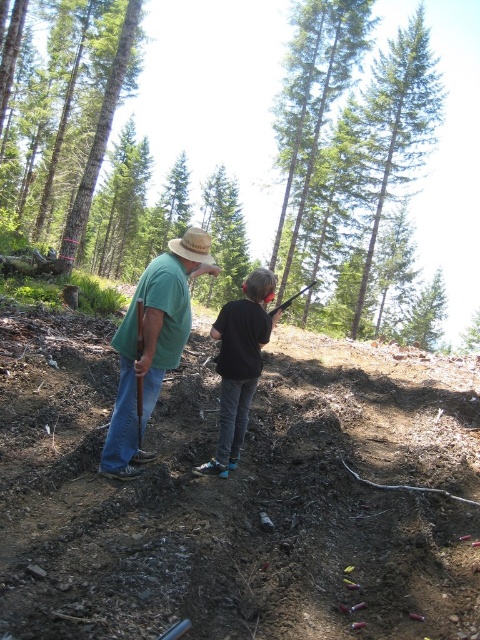
Question: Is green matte shirt at center to the left of black matte shirt at center from the viewer's perspective?

Choices:
 (A) no
 (B) yes

Answer: (B)

Question: Which object is closer to the camera taking this photo?

Choices:
 (A) green textured pine trees at upper center
 (B) black matte shirt at center

Answer: (B)

Question: Which point appears farthest from the camera in this image?

Choices:
 (A) (408, 60)
 (B) (39, 128)
 (C) (111, 109)
 (D) (204, 212)

Answer: (D)

Question: Is green matte shirt at center to the right of green matte tree at center from the viewer's perspective?

Choices:
 (A) no
 (B) yes

Answer: (B)

Question: Does green textured pine trees at upper center have a larger size compared to green matte tree at center?

Choices:
 (A) yes
 (B) no

Answer: (A)

Question: Which object appears closest to the camera in this image?

Choices:
 (A) green leafy tree at upper center
 (B) smooth bark tree at upper left
 (C) green textured pine trees at upper center
 (D) green matte tree at center

Answer: (B)